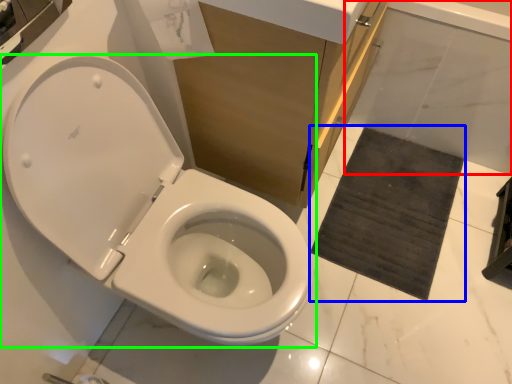
Question: Which object is the closest to the bath (highlighted by a red box)? Choose among these: bath mat (highlighted by a blue box) or toilet (highlighted by a green box).

Choices:
 (A) bath mat
 (B) toilet

Answer: (A)